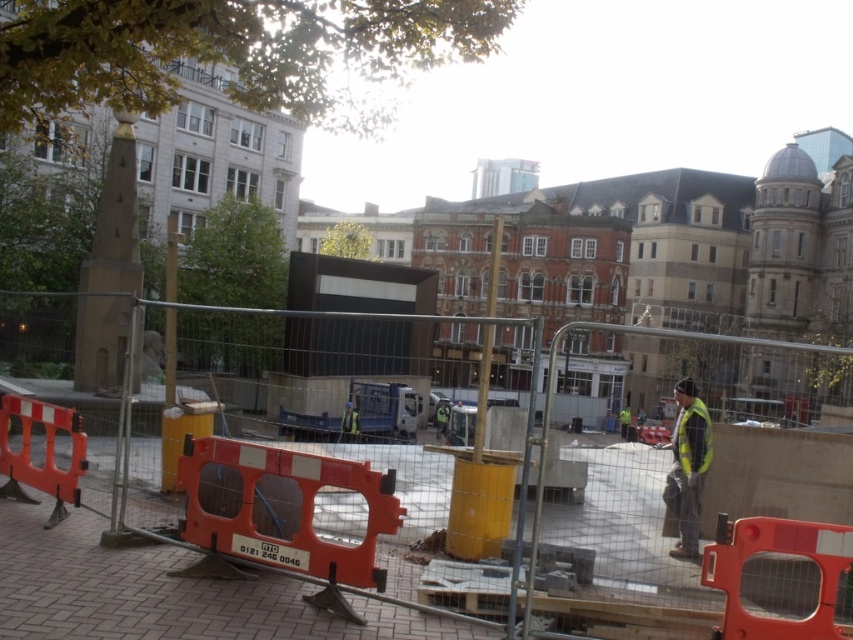
You are a pedestrian walking past the construction site and notice two safety vests. The first is the reflective yellow vest at center and the second is the yellow reflective safety vest at right. From your perspective, which vest is positioned lower in the image?

The reflective yellow vest at center is located below the yellow reflective safety vest at right, so the reflective yellow vest at center is positioned lower in the image.

You are a delivery driver approaching the construction site. There are two points marked on your map that you need to reach. The first point is at coordinate point(810,616) and the second is at point(682,429). Which point should you reach first to stay closer to the construction site fence?

Point(810,616) is closer to the viewer than point(682,429), so you should reach point(810,616) first to stay closer to the construction site fence.

You are a delivery person who needs to navigate through an urban construction site. You see a reflective yellow vest at center and a yellow reflective safety vest at right. The path between them is narrow. If your delivery cart is 2 feet wide, can you safely pass through the space between them without touching either?

The reflective yellow vest at center is 31.40 inches away from the yellow reflective safety vest at right. Since 31.40 inches is approximately 2.62 feet, which is wider than the cart width of 2 feet, you can safely pass through the space between them without touching either.